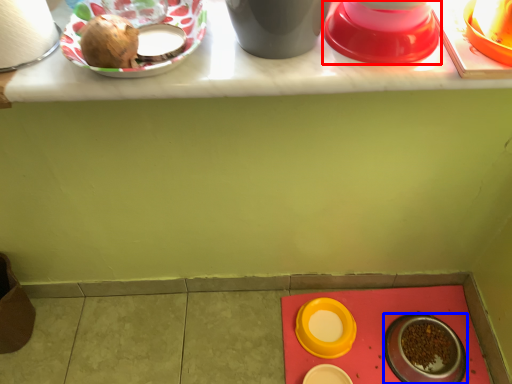
Question: Which point is further to the camera, tableware (highlighted by a red box) or tableware (highlighted by a blue box)?

Choices:
 (A) tableware
 (B) tableware

Answer: (B)